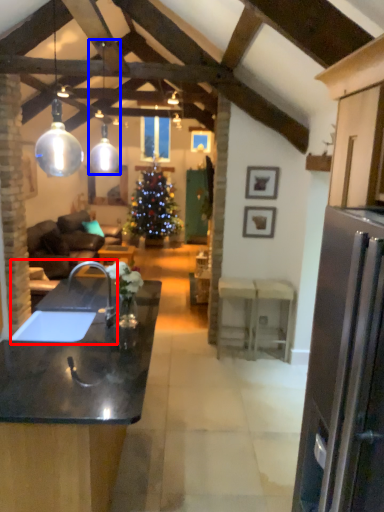
Question: Which object is further to the camera taking this photo, sink (highlighted by a red box) or lamp (highlighted by a blue box)?

Choices:
 (A) sink
 (B) lamp

Answer: (B)